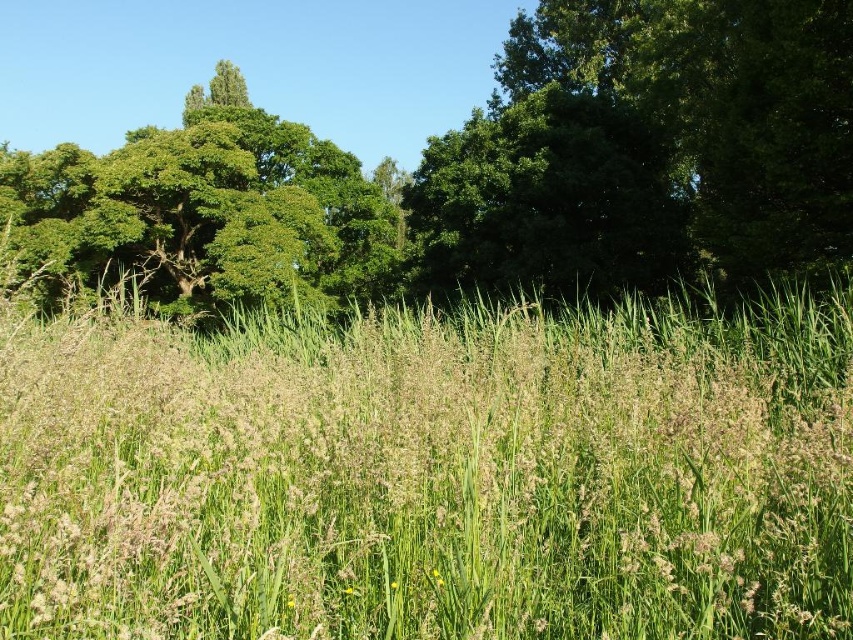
Question: Does green leafy tree at upper center appear on the right side of green leafy tree at upper left?

Choices:
 (A) yes
 (B) no

Answer: (A)

Question: Does green leafy tree at upper center have a smaller size compared to green leafy tree at upper left?

Choices:
 (A) no
 (B) yes

Answer: (A)

Question: Which object is the farthest from the green leafy tree at upper left?

Choices:
 (A) green grassy field at center
 (B) green leafy tree at upper center

Answer: (A)

Question: Does green grassy field at center appear on the left side of green leafy tree at upper center?

Choices:
 (A) no
 (B) yes

Answer: (A)

Question: Which object is the farthest from the green leafy tree at upper center?

Choices:
 (A) green grassy field at center
 (B) green leafy tree at upper left

Answer: (A)

Question: Which point appears closest to the camera in this image?

Choices:
 (A) (270, 156)
 (B) (763, 102)

Answer: (B)